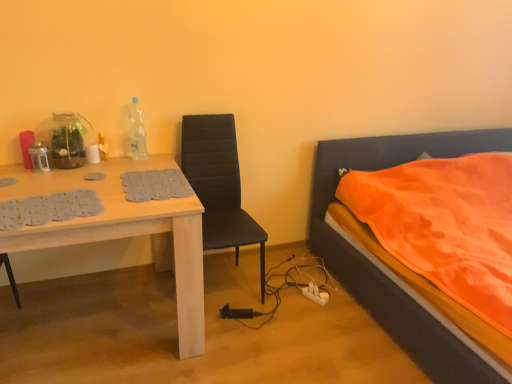
Question: From their relative heights in the image, would you say white plastic power outlet at lower center is taller or shorter than black leather chair at center?

Choices:
 (A) short
 (B) tall

Answer: (A)

Question: Considering the relative positions of white plastic power outlet at lower center and black leather chair at center in the image provided, is white plastic power outlet at lower center to the left or to the right of black leather chair at center?

Choices:
 (A) right
 (B) left

Answer: (A)

Question: Which of these objects is positioned closest to the white plastic power outlet at lower center?

Choices:
 (A) light wood table at left
 (B) transparent plastic bottle at upper center
 (C) orange fabric bed at right
 (D) black leather chair at center

Answer: (C)

Question: Estimate the real-world distances between objects in this image. Which object is closer to the light wood table at left?

Choices:
 (A) transparent plastic bottle at upper center
 (B) orange fabric bed at right
 (C) black leather chair at center
 (D) white plastic power outlet at lower center

Answer: (C)